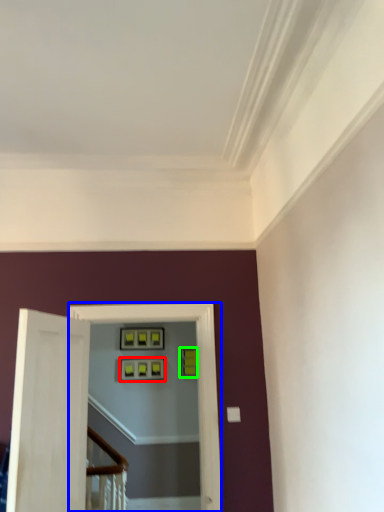
Question: Estimate the real-world distances between objects in this image. Which object is farther from picture frame (highlighted by a red box), passage (highlighted by a blue box) or picture frame (highlighted by a green box)?

Choices:
 (A) passage
 (B) picture frame

Answer: (A)